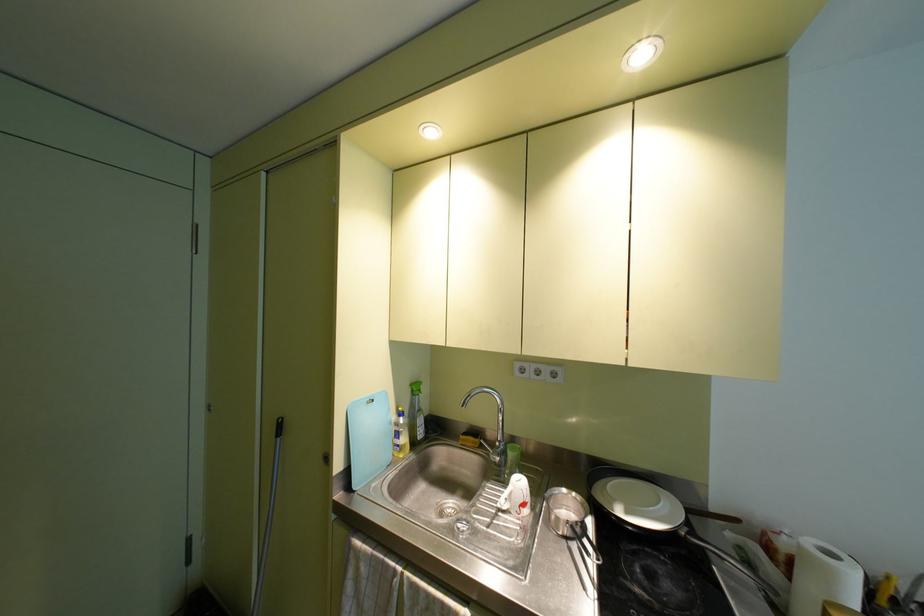
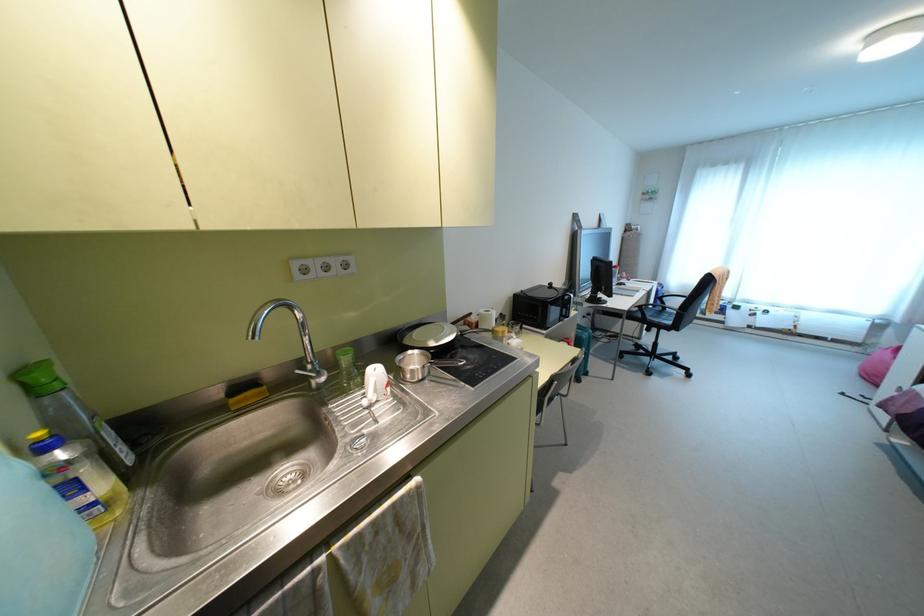
How did the camera likely rotate?

The camera rotated toward right-down.